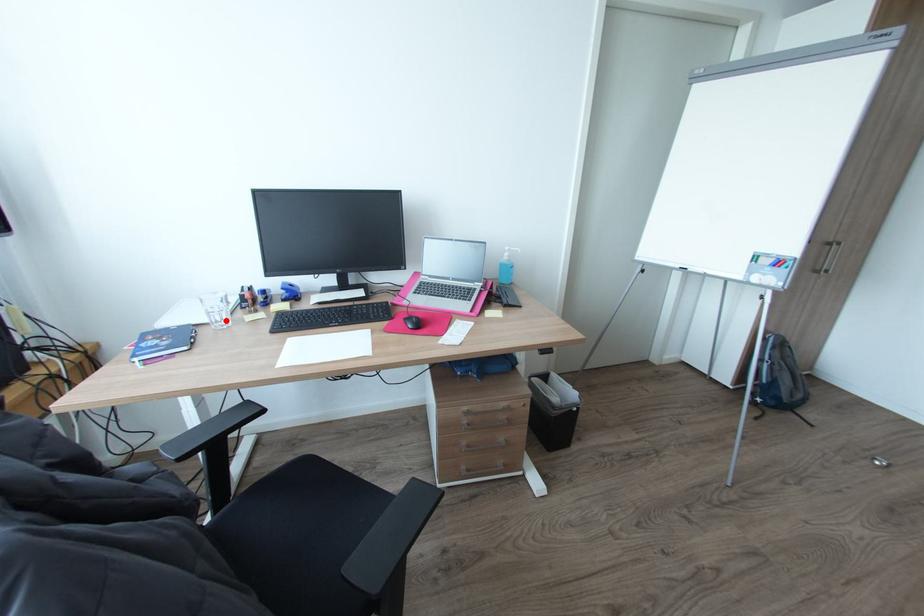
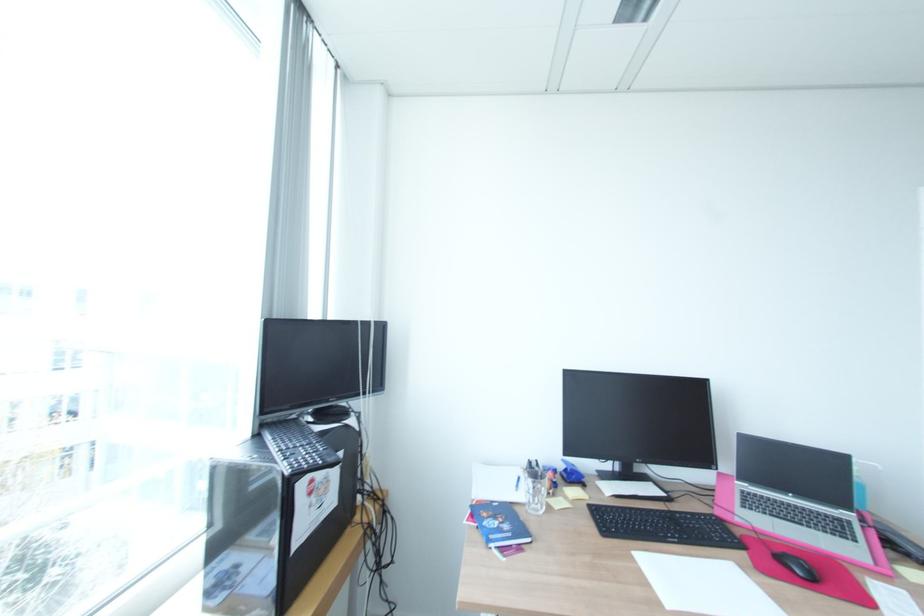
Question: I am providing you with two images of the same scene from different viewpoints. Given a red point in image1, look at the same physical point in image2. Is it:

Choices:
 (A) Closer to the viewpoint
 (B) Farther from the viewpoint

Answer: (B)